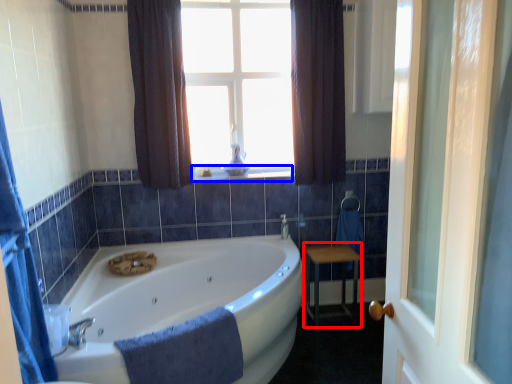
Question: Which point is closer to the camera, table (highlighted by a red box) or window sill (highlighted by a blue box)?

Choices:
 (A) table
 (B) window sill

Answer: (A)